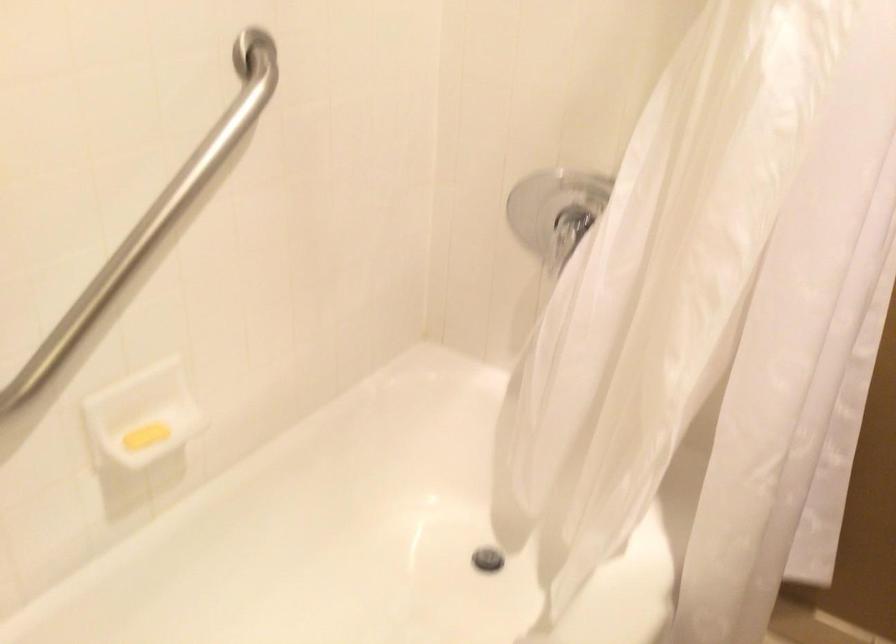
Locate an element on the screen. The width and height of the screenshot is (896, 644). yellow soap bar is located at coordinates (145, 436).